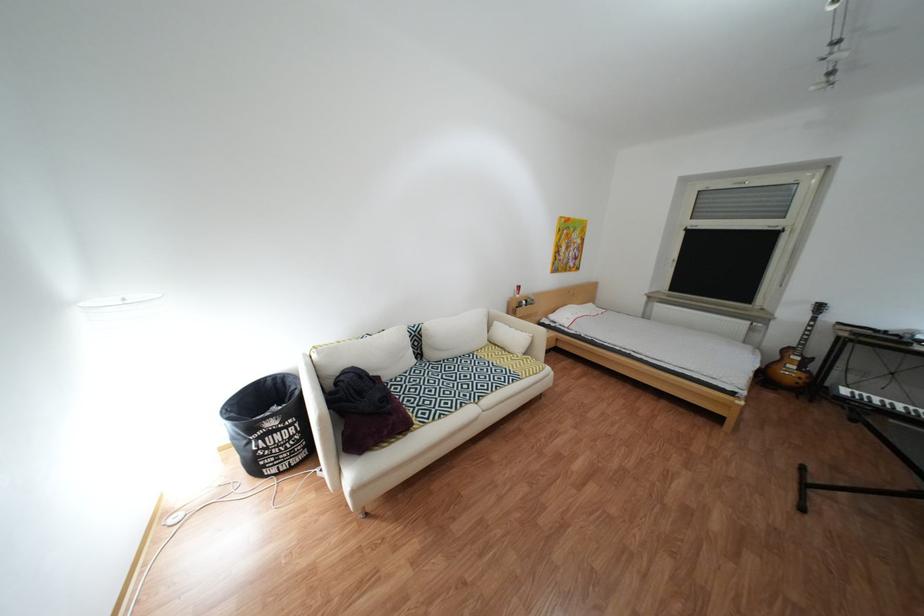
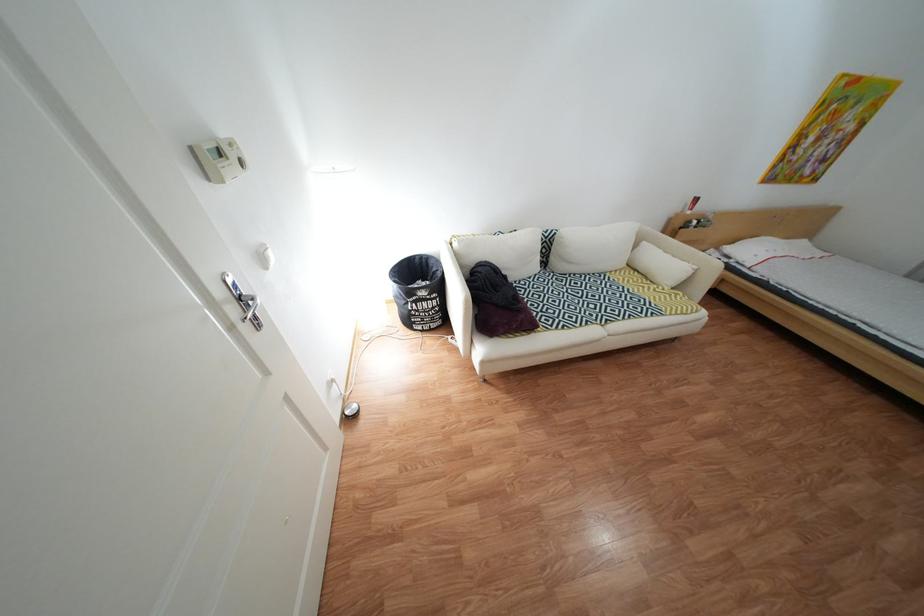
Locate, in the second image, the point that corresponds to the point at 402,434 in the first image.

(530, 328)